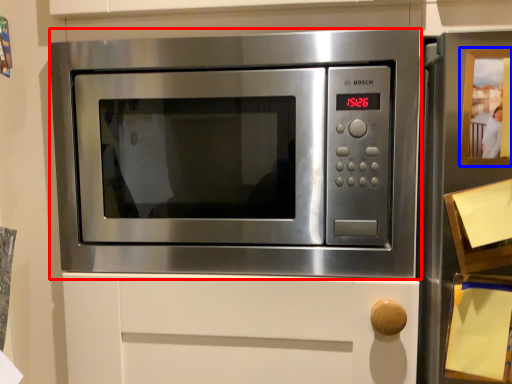
Question: Which object is further to the camera taking this photo, microwave oven (highlighted by a red box) or button (highlighted by a blue box)?

Choices:
 (A) microwave oven
 (B) button

Answer: (A)